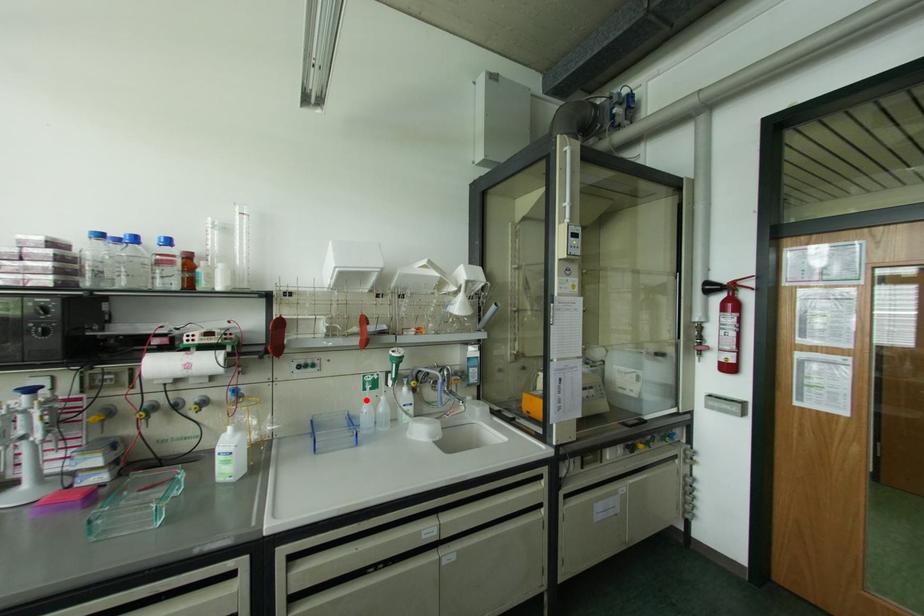
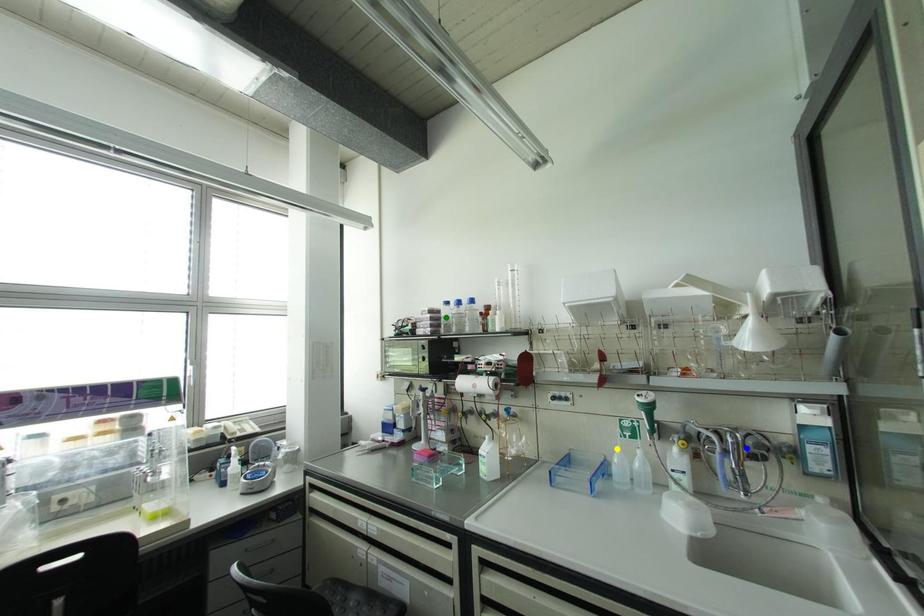
Question: I am providing you with two images of the same scene from different viewpoints. A red point is marked on the first image. You are given multiple points on the second image. Which point in image 2 represents the same 3d spot as the red point in image 1?

Choices:
 (A) blue point
 (B) yellow point
 (C) green point

Answer: (B)